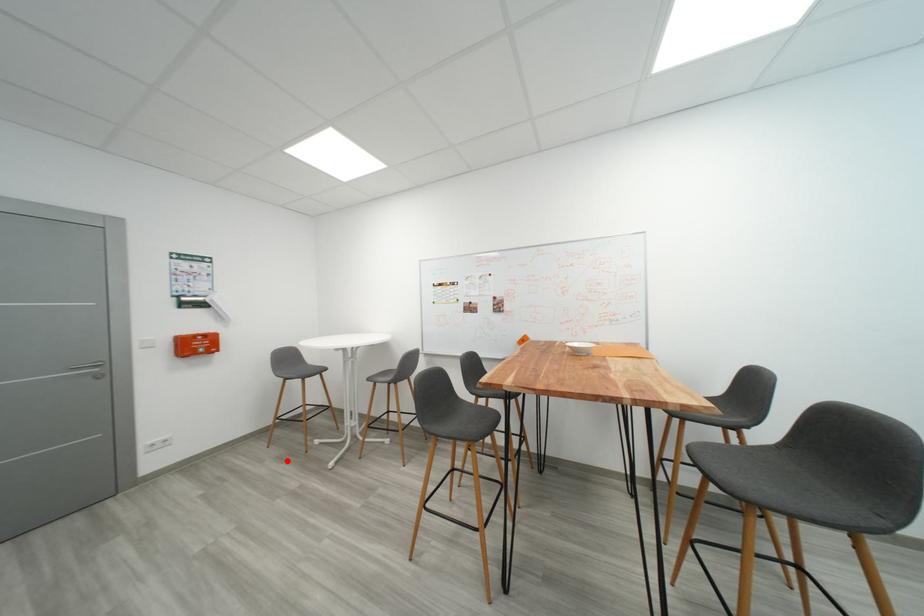
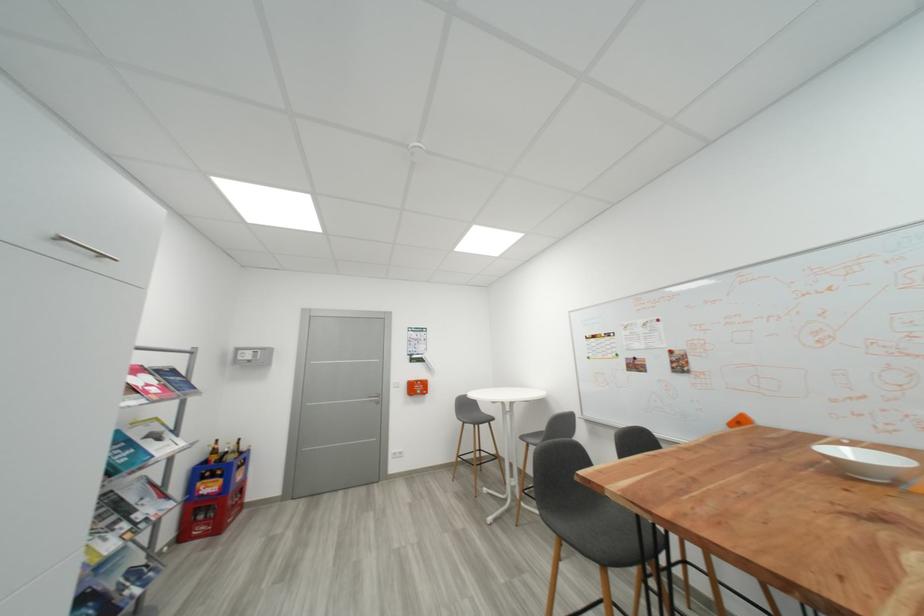
Locate, in the second image, the point that corresponds to the highlighted location in the first image.

(465, 496)